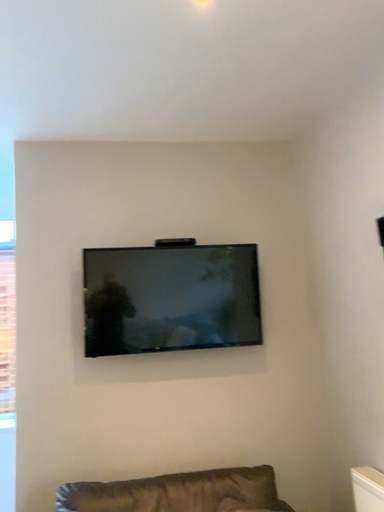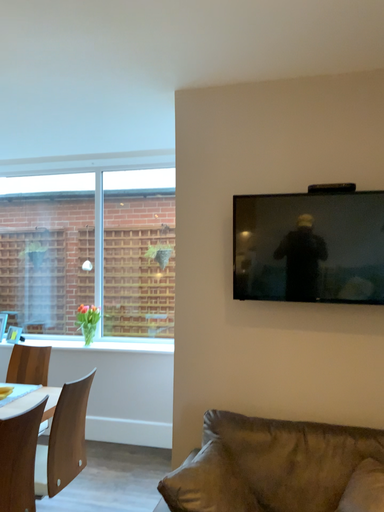
Question: Which way did the camera rotate in the video?

Choices:
 (A) rotated upward
 (B) rotated downward

Answer: (B)